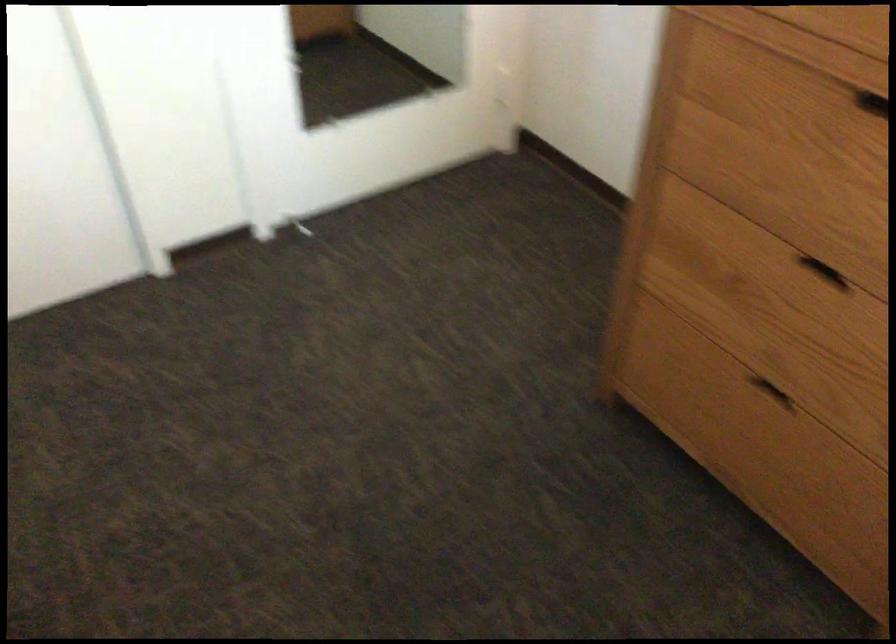
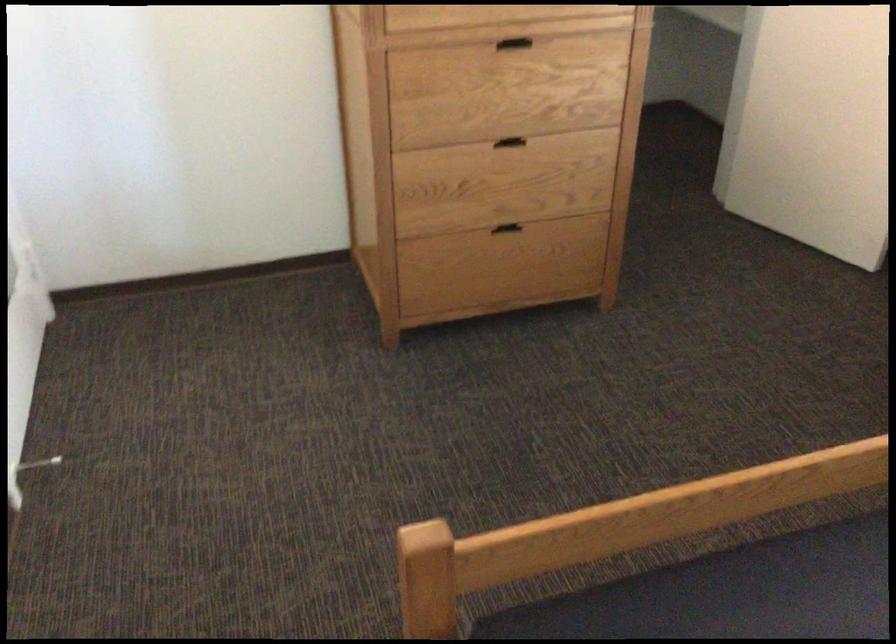
Locate, in the second image, the point that corresponds to point (768, 412) in the first image.

(510, 236)